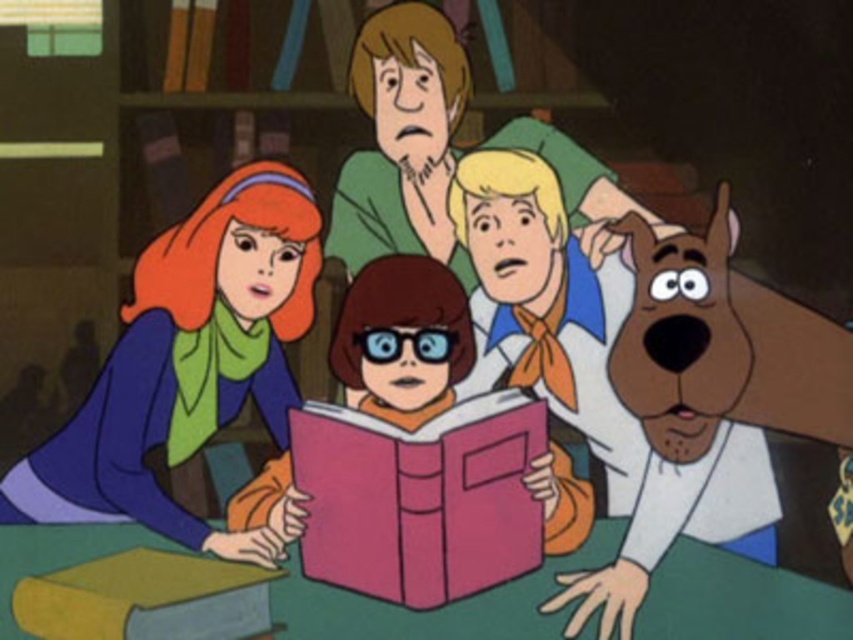
From the picture: You are a character in the scene and want to grab the yellow matte book at lower left. Which direction should you move relative to the pink matte book at center?

The yellow matte book at lower left is below the pink matte book at center, so you should move downward from the pink matte book at center to reach the yellow matte book at lower left.